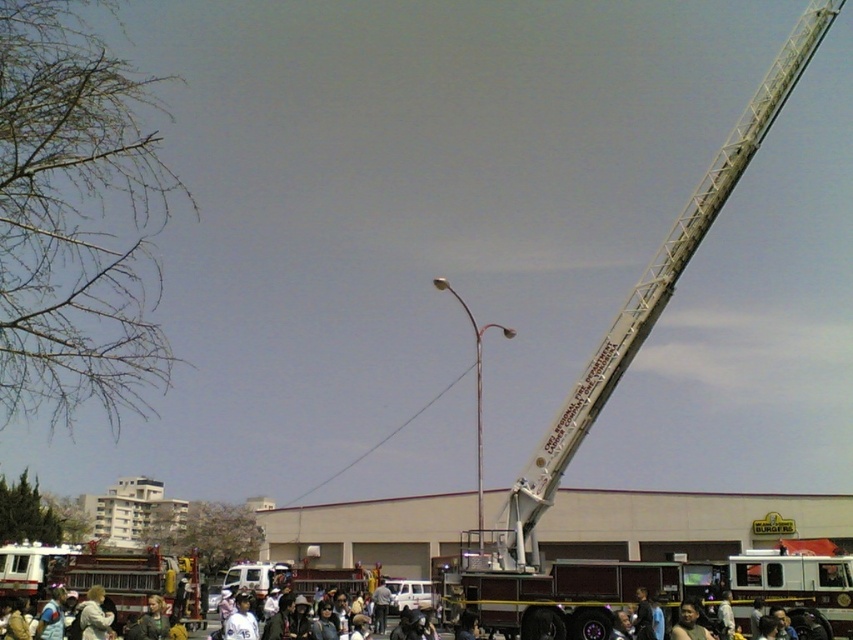
Question: Which object appears farthest from the camera in this image?

Choices:
 (A) dark brown leather jacket at lower center
 (B) metallic silver fire truck at center
 (C) white fabric jacket at lower center

Answer: (C)

Question: Which object is the farthest from the dark blue shirt at lower right?

Choices:
 (A) brushed metal fire truck at lower left
 (B) white fabric jacket at lower center
 (C) dark brown leather jacket at lower center

Answer: (A)

Question: Can you confirm if metallic silver fire truck at center is smaller than white fabric jacket at lower center?

Choices:
 (A) yes
 (B) no

Answer: (B)

Question: Does white fabric jacket at lower center appear on the right side of dark brown leather jacket at lower center?

Choices:
 (A) yes
 (B) no

Answer: (B)

Question: Is metallic silver fire truck at center thinner than white fabric jacket at lower center?

Choices:
 (A) no
 (B) yes

Answer: (A)

Question: Which object appears closest to the camera in this image?

Choices:
 (A) brushed metal fire truck at lower left
 (B) dark blue shirt at lower right
 (C) metallic silver fire truck at center

Answer: (C)